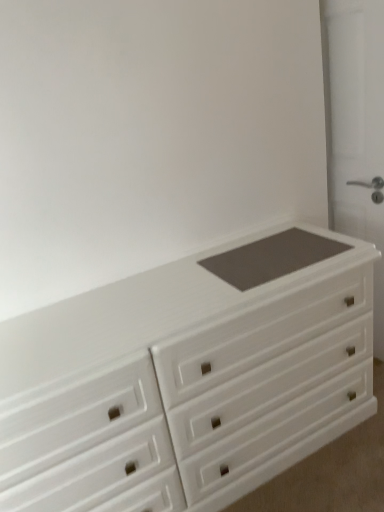
The width and height of the screenshot is (384, 512). Describe the element at coordinates (356, 128) in the screenshot. I see `matte gray screen door at right` at that location.

This screenshot has width=384, height=512. What are the coordinates of `matte gray screen door at right` in the screenshot? It's located at (356, 128).

Measure the distance between point (9, 338) and camera.

They are 1.32 meters apart.

This screenshot has height=512, width=384. What do you see at coordinates (189, 377) in the screenshot?
I see `white glossy chest of drawers at center` at bounding box center [189, 377].

The width and height of the screenshot is (384, 512). Identify the location of white glossy chest of drawers at center. (189, 377).

This screenshot has height=512, width=384. I want to click on matte gray screen door at right, so click(356, 128).

Considering the relative positions of matte gray screen door at right and white glossy chest of drawers at center in the image provided, is matte gray screen door at right to the left or to the right of white glossy chest of drawers at center?

In the image, matte gray screen door at right appears on the right side of white glossy chest of drawers at center.

Is matte gray screen door at right further to camera compared to white glossy chest of drawers at center?

Yes, matte gray screen door at right is further from the camera.

Which point is more forward, (x=357, y=30) or (x=342, y=249)?

Point (x=342, y=249)

From the image's perspective, which one is positioned lower, matte gray screen door at right or white glossy chest of drawers at center?

white glossy chest of drawers at center appears lower in the image.

From a real-world perspective, is matte gray screen door at right physically below white glossy chest of drawers at center?

No.

Which of these two, matte gray screen door at right or white glossy chest of drawers at center, is wider?

white glossy chest of drawers at center is wider.

Considering the sizes of objects matte gray screen door at right and white glossy chest of drawers at center in the image provided, who is taller, matte gray screen door at right or white glossy chest of drawers at center?

Standing taller between the two is matte gray screen door at right.

From the picture: Considering the sizes of objects matte gray screen door at right and white glossy chest of drawers at center in the image provided, who is bigger, matte gray screen door at right or white glossy chest of drawers at center?

With larger size is white glossy chest of drawers at center.

Is matte gray screen door at right not inside white glossy chest of drawers at center?

matte gray screen door at right lies outside white glossy chest of drawers at center's area.

Is matte gray screen door at right far away from white glossy chest of drawers at center?

No, matte gray screen door at right is in close proximity to white glossy chest of drawers at center.

Could you tell me if matte gray screen door at right is turned towards white glossy chest of drawers at center?

No, matte gray screen door at right is not oriented towards white glossy chest of drawers at center.

How many degrees apart are the facing directions of matte gray screen door at right and white glossy chest of drawers at center?

94.3 degrees separate the facing orientations of matte gray screen door at right and white glossy chest of drawers at center.

Where is `screen door lying above the white glossy chest of drawers at center (from the image's perspective)`? This screenshot has width=384, height=512. screen door lying above the white glossy chest of drawers at center (from the image's perspective) is located at coordinates (356, 128).

Does white glossy chest of drawers at center appear on the left side of matte gray screen door at right?

Indeed, white glossy chest of drawers at center is positioned on the left side of matte gray screen door at right.

Which object is further away from the camera, white glossy chest of drawers at center or matte gray screen door at right?

matte gray screen door at right.

Is point (207, 251) less distant than point (375, 323)?

No, (207, 251) is further to viewer.

From the image's perspective, is white glossy chest of drawers at center under matte gray screen door at right?

Correct, white glossy chest of drawers at center appears lower than matte gray screen door at right in the image.

From a real-world perspective, is white glossy chest of drawers at center physically above matte gray screen door at right?

No, from a real-world perspective, white glossy chest of drawers at center is not on top of matte gray screen door at right.

From the picture: Is white glossy chest of drawers at center thinner than matte gray screen door at right?

In fact, white glossy chest of drawers at center might be wider than matte gray screen door at right.

In terms of height, does white glossy chest of drawers at center look taller or shorter compared to matte gray screen door at right?

Clearly, white glossy chest of drawers at center is shorter compared to matte gray screen door at right.

Considering the sizes of white glossy chest of drawers at center and matte gray screen door at right in the image, is white glossy chest of drawers at center bigger or smaller than matte gray screen door at right?

In the image, white glossy chest of drawers at center appears to be larger than matte gray screen door at right.

Is white glossy chest of drawers at center completely or partially outside of matte gray screen door at right?

white glossy chest of drawers at center is positioned outside matte gray screen door at right.

Are white glossy chest of drawers at center and matte gray screen door at right beside each other?

No, white glossy chest of drawers at center is not next to matte gray screen door at right.

Is white glossy chest of drawers at center aimed at matte gray screen door at right?

No, white glossy chest of drawers at center is not oriented towards matte gray screen door at right.

At what (x,y) coordinates should I click in order to perform the action: click on screen door behind the white glossy chest of drawers at center. Please return your answer as a coordinate pair (x, y). The height and width of the screenshot is (512, 384). Looking at the image, I should click on (x=356, y=128).

Where is `screen door above the white glossy chest of drawers at center (from a real-world perspective)`? This screenshot has width=384, height=512. screen door above the white glossy chest of drawers at center (from a real-world perspective) is located at coordinates (356, 128).

Locate an element on the screen. The width and height of the screenshot is (384, 512). the chest of drawers located underneath the matte gray screen door at right (from a real-world perspective) is located at coordinates (189, 377).